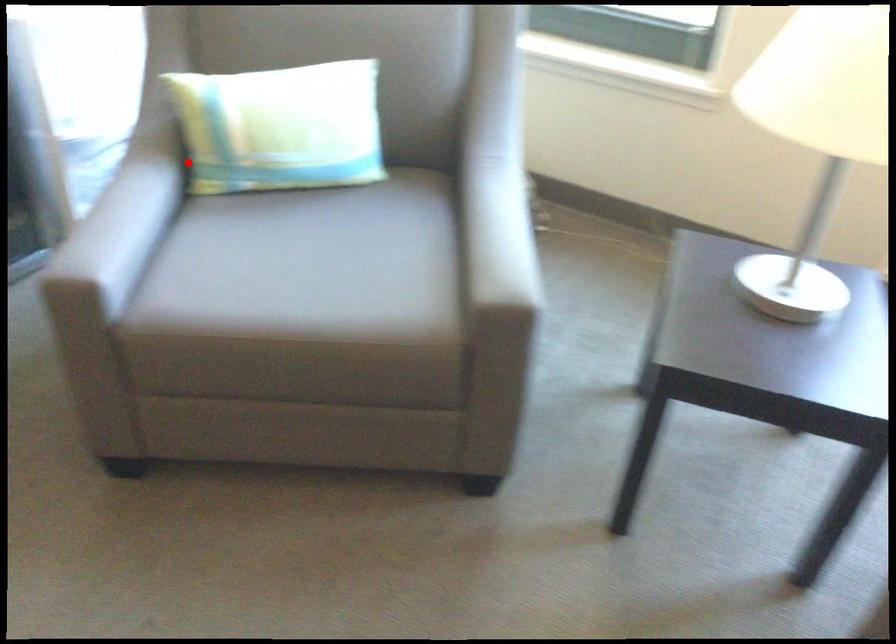
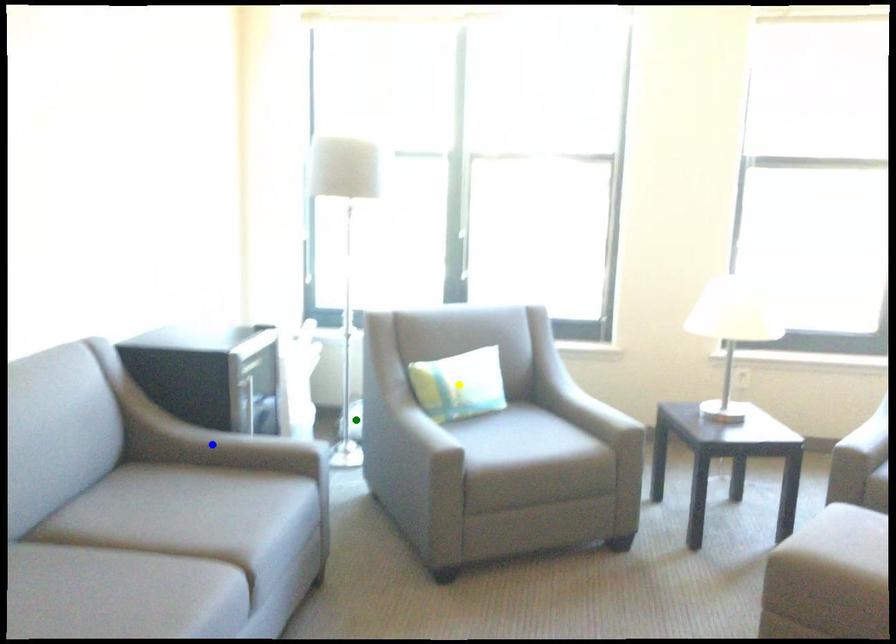
Question: I am providing you with two images of the same scene from different viewpoints. A red point is marked on the first image. You are given multiple points on the second image. Which spot in image 2 lines up with the point in image 1?

Choices:
 (A) green point
 (B) yellow point
 (C) blue point

Answer: (A)